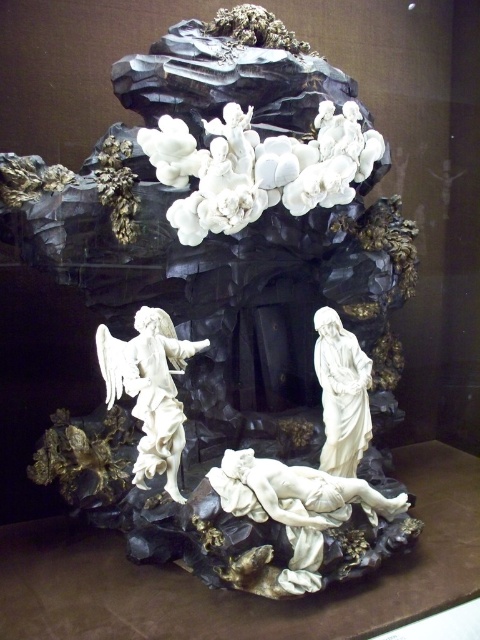
Question: Is white porcelain angel at left to the right of white porcelain angel at center from the viewer's perspective?

Choices:
 (A) no
 (B) yes

Answer: (A)

Question: Can you confirm if white porcelain cloud at upper center is bigger than white porcelain angel at left?

Choices:
 (A) yes
 (B) no

Answer: (A)

Question: Which is farther from the white porcelain cloud at upper center?

Choices:
 (A) white marble angel at center
 (B) white porcelain angel at left

Answer: (A)

Question: Estimate the real-world distances between objects in this image. Which object is farther from the white marble angel at center?

Choices:
 (A) white porcelain cloud at upper center
 (B) white porcelain angel at left

Answer: (A)

Question: Observing the image, what is the correct spatial positioning of white porcelain cloud at upper center in reference to white porcelain angel at left?

Choices:
 (A) below
 (B) above

Answer: (B)

Question: Which object is farther from the camera taking this photo?

Choices:
 (A) white porcelain cloud at upper center
 (B) white marble angel at center
 (C) white porcelain angel at left
 (D) white porcelain angel at center

Answer: (B)